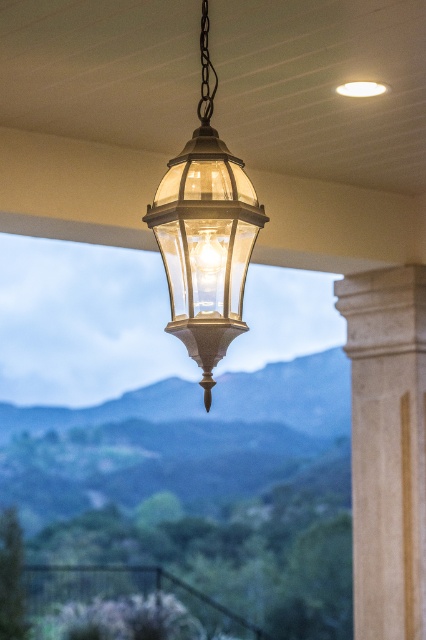
You are an interior designer assessing the placement of the white marble column at right and the matte glass lantern at center in a room. Based on their heights, which object would require more vertical space to accommodate?

The white marble column at right has a greater height compared to the matte glass lantern at center, so it would require more vertical space to accommodate.

You are standing in the room with the vintage lantern and want to place a small potted plant on the floor near the white marble column at right. If the column is at position coordinates of 0.700, 0.908, where should you place the plant to ensure it is directly to the left of the column?

The white marble column at right is located at coordinates (386, 448). To place the plant directly to the left of it, you should position the plant at coordinates slightly less than 0.700 on the x axis while keeping the y coordinate around 0.908.

You are standing in a room with the vintage lantern hanging from the ceiling. You want to reach a point that is exactly 40 feet away from you. Is the point at point (x=316, y=637) within that 40 feet range?

The distance between you and point (x=316, y=637) is 41.60 feet, which is beyond the 40 feet range. Therefore, the point is outside the desired distance.